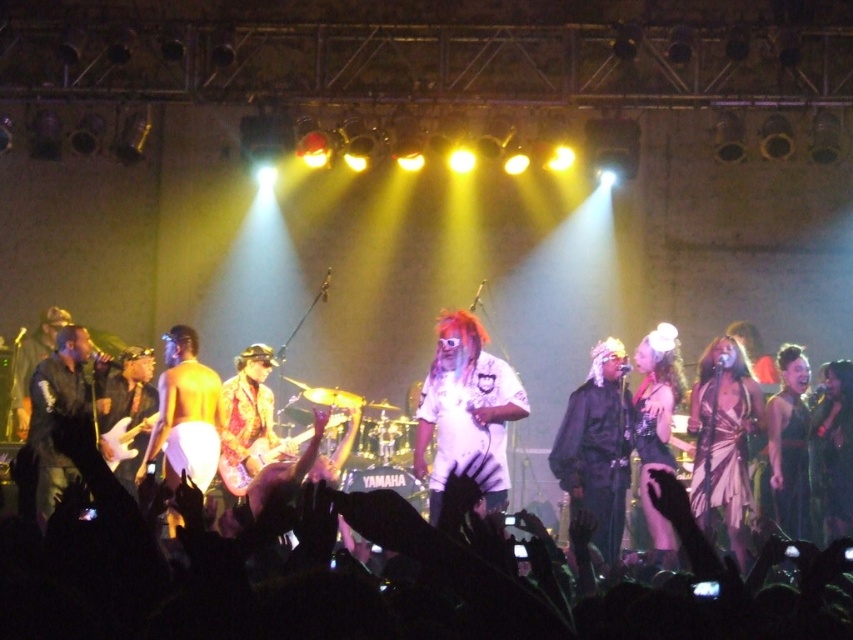
Question: From the image, what is the correct spatial relationship of white matte shirt at center in relation to black satin dress at right?

Choices:
 (A) right
 (B) left

Answer: (B)

Question: Does shiny black guitar at center have a lesser width compared to shiny metallic guitar at center?

Choices:
 (A) no
 (B) yes

Answer: (B)

Question: Which point is closer to the camera?

Choices:
 (A) (109, 388)
 (B) (714, 445)

Answer: (B)

Question: Among these points, which one is farthest from the camera?

Choices:
 (A) (610, 364)
 (B) (717, 490)
 (C) (223, 454)

Answer: (C)

Question: Can you confirm if black leather jacket at left is smaller than black satin dress at right?

Choices:
 (A) no
 (B) yes

Answer: (B)

Question: Which of the following is the farthest from the observer?

Choices:
 (A) black leather jacket at left
 (B) shiny silver dress at center right

Answer: (A)